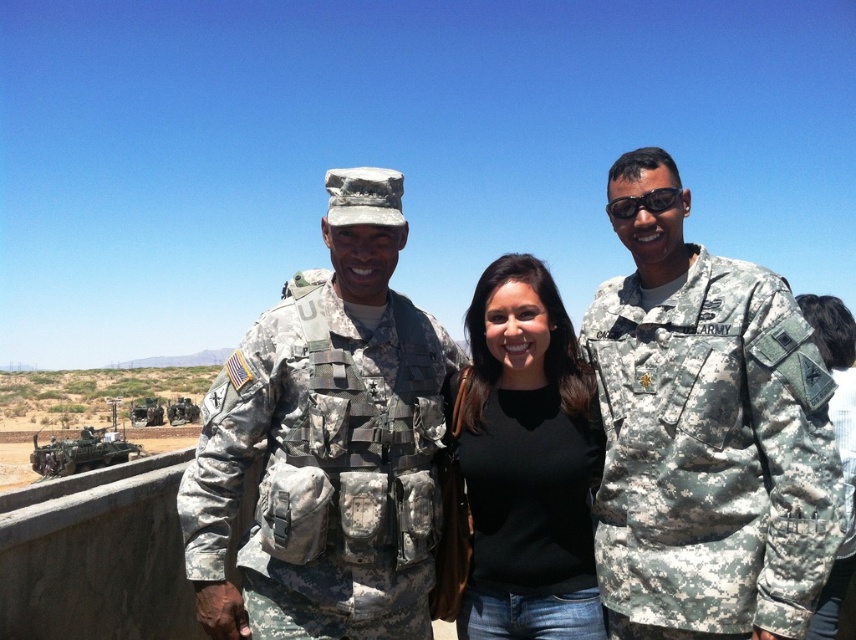
Does camouflage uniform at center have a lesser height compared to black matte shirt at center?

Incorrect, camouflage uniform at center's height does not fall short of black matte shirt at center's.

At what (x,y) coordinates should I click in order to perform the action: click on camouflage uniform at center. Please return your answer as a coordinate pair (x, y). Looking at the image, I should click on (706, 433).

Which is behind, point (736, 497) or point (525, 608)?

Positioned behind is point (525, 608).

This screenshot has height=640, width=856. What are the coordinates of `camouflage uniform at center` in the screenshot? It's located at (706, 433).

Which is more to the right, camouflage uniform at center or camouflage fabric uniform at center?

Positioned to the right is camouflage uniform at center.

Can you confirm if camouflage uniform at center is wider than camouflage fabric uniform at center?

Yes, camouflage uniform at center is wider than camouflage fabric uniform at center.

Where is `camouflage uniform at center`? The image size is (856, 640). camouflage uniform at center is located at coordinates (706, 433).

Can you confirm if camouflage fabric uniform at right is smaller than black matte shirt at center?

No, camouflage fabric uniform at right is not smaller than black matte shirt at center.

Which is in front, point (782, 433) or point (535, 284)?

Point (782, 433) is in front.

In order to click on camouflage fabric uniform at right in this screenshot , I will do `click(705, 433)`.